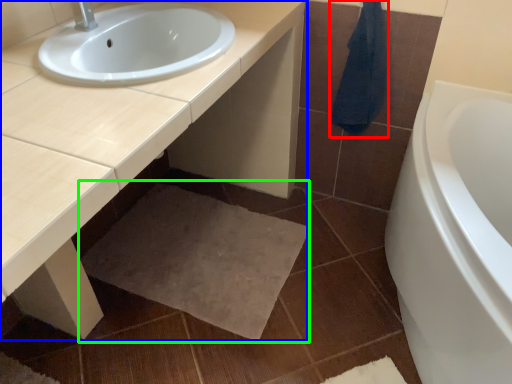
Question: Which object is the farthest from bath towel (highlighted by a red box)? Choose among these: countertop (highlighted by a blue box) or bath mat (highlighted by a green box).

Choices:
 (A) countertop
 (B) bath mat

Answer: (B)